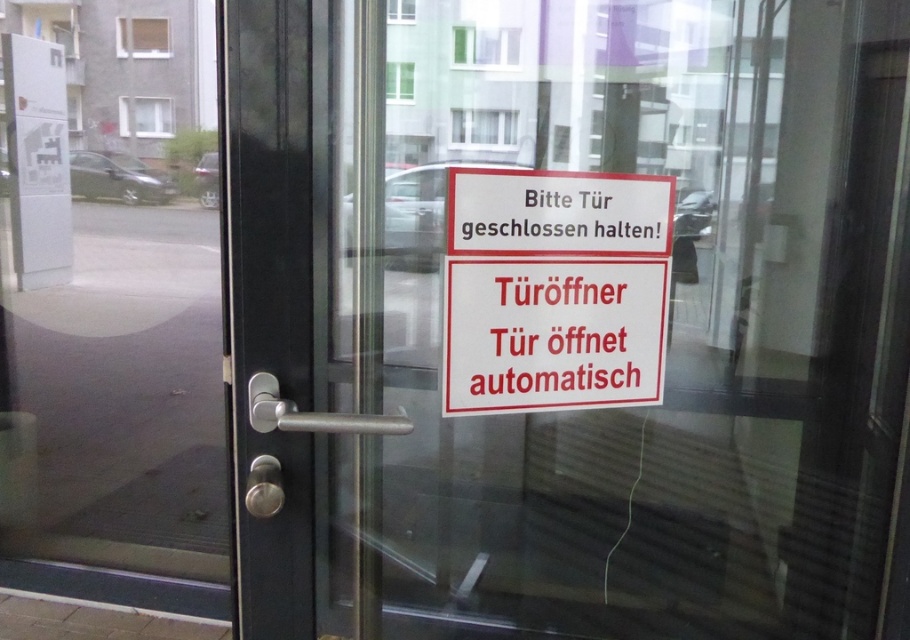
Is point (573, 620) farther from camera compared to point (48, 209)?

That is False.

Does transparent glass door at center have a smaller size compared to white plastic parking sign at upper left?

Incorrect, transparent glass door at center is not smaller in size than white plastic parking sign at upper left.

Identify the location of transparent glass door at center. The width and height of the screenshot is (910, 640). (666, 321).

Where is `transparent glass door at center`? The width and height of the screenshot is (910, 640). transparent glass door at center is located at coordinates (666, 321).

Is red plastic sign at center shorter than white plastic parking sign at upper left?

Yes.

Which is more to the left, red plastic sign at center or white plastic parking sign at upper left?

Positioned to the left is white plastic parking sign at upper left.

Does point (519, 365) lie in front of point (6, 76)?

Yes, point (519, 365) is closer to viewer.

What are the coordinates of `red plastic sign at center` in the screenshot? It's located at (554, 291).

Which is below, transparent glass door at center or red plastic sign at center?

transparent glass door at center is below.

Based on the photo, does transparent glass door at center lie behind red plastic sign at center?

No, transparent glass door at center is in front of red plastic sign at center.

Identify the location of transparent glass door at center. This screenshot has height=640, width=910. (666, 321).

Identify the location of transparent glass door at center. (666, 321).